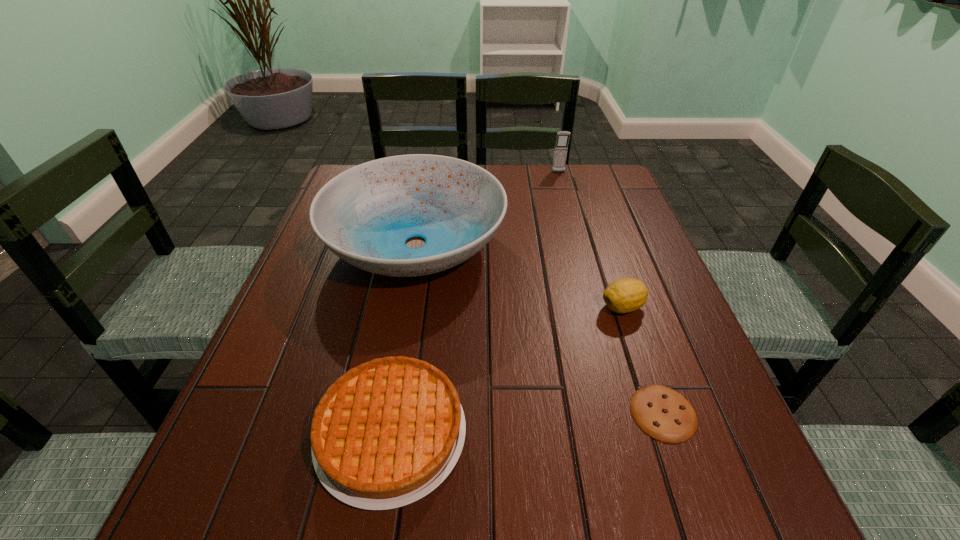
The image size is (960, 540). In order to click on the farthest object in this screenshot , I will do 561,146.

The image size is (960, 540). In order to click on dish in this screenshot , I will do `click(364, 215)`.

This screenshot has height=540, width=960. Find the location of `lemon`. lemon is located at coordinates (624, 295).

This screenshot has width=960, height=540. I want to click on pie, so click(386, 433).

Image resolution: width=960 pixels, height=540 pixels. I want to click on the shortest object, so (x=661, y=412).

Identify the location of vacant space located 0.050m on the front-facing side of the farthest object. (561, 181).

Locate an element on the screen. This screenshot has width=960, height=540. free space located on the right of the dish is located at coordinates (612, 244).

Where is `vacant area situated 0.370m at the stem end of the third tallest object`? Image resolution: width=960 pixels, height=540 pixels. vacant area situated 0.370m at the stem end of the third tallest object is located at coordinates (429, 307).

Where is `free space located at the stem end of the third tallest object`? The height and width of the screenshot is (540, 960). free space located at the stem end of the third tallest object is located at coordinates (420, 307).

You are a GUI agent. You are given a task and a screenshot of the screen. Output one action in this format:
    pyautogui.click(x=<x>, y=<y>)
    Task: Click on the vacant space located at the stem end of the third tallest object
    This screenshot has width=960, height=540.
    Given the screenshot: What is the action you would take?
    pyautogui.click(x=535, y=307)